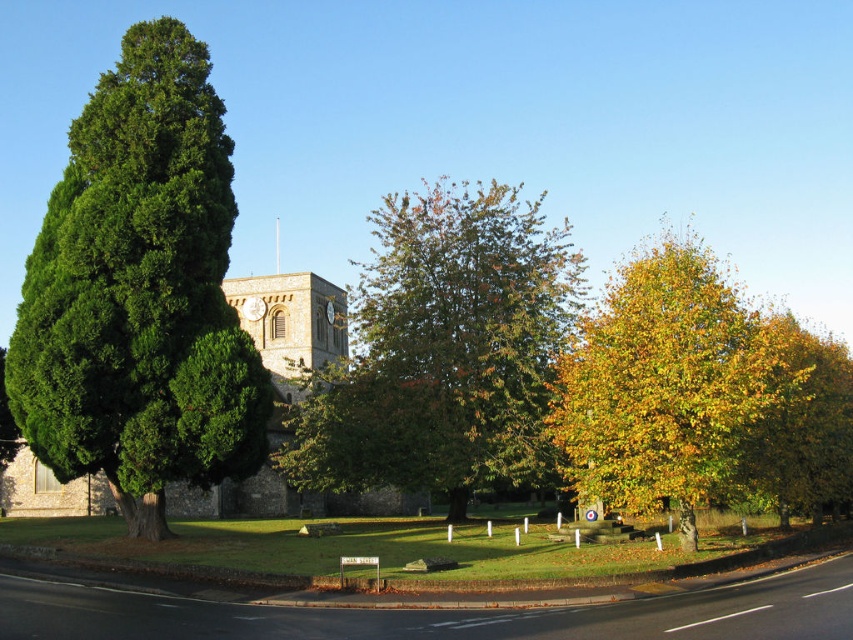
Question: Considering the relative positions of yellow-green foliage at right and yellow-green leaves at right in the image provided, where is yellow-green foliage at right located with respect to yellow-green leaves at right?

Choices:
 (A) below
 (B) above

Answer: (B)

Question: Which point is farther to the camera?

Choices:
 (A) green leafy tree at center
 (B) yellow-green leaves at right
 (C) green leafy tree at left

Answer: (A)

Question: Which point is closer to the camera?

Choices:
 (A) green leafy tree at left
 (B) yellow-green leaves at right
 (C) green leafy tree at center
 (D) yellow-green foliage at right

Answer: (B)

Question: Does green leafy tree at left appear on the left side of yellow-green leaves at right?

Choices:
 (A) no
 (B) yes

Answer: (B)

Question: Which point appears farthest from the camera in this image?

Choices:
 (A) (729, 278)
 (B) (67, 468)
 (C) (519, 452)
 (D) (769, 429)

Answer: (A)

Question: Does yellow-green foliage at right appear under yellow-green leaves at right?

Choices:
 (A) yes
 (B) no

Answer: (B)